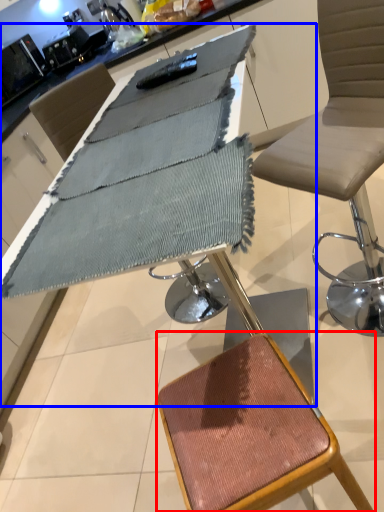
Question: Which point is closer to the camera, stool (highlighted by a red box) or table (highlighted by a blue box)?

Choices:
 (A) stool
 (B) table

Answer: (B)